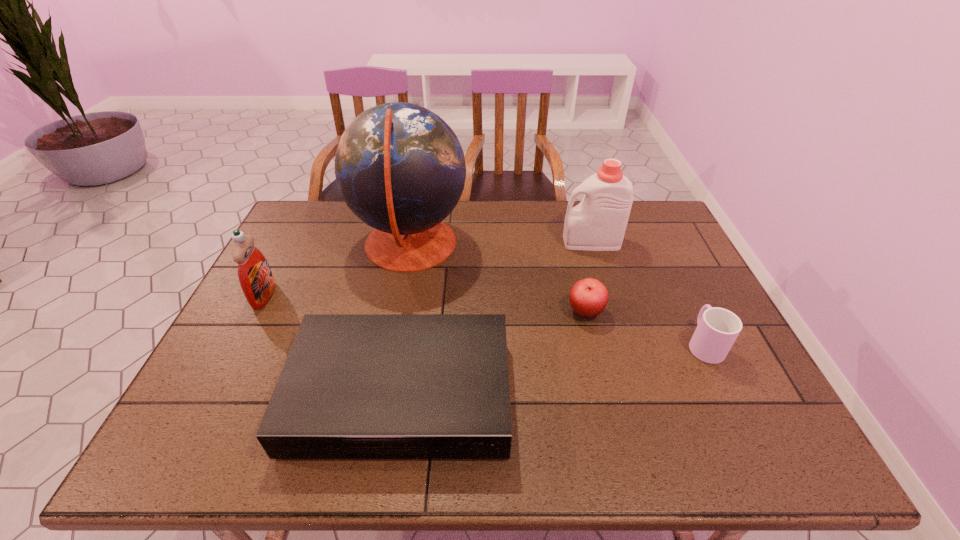
Locate an element on the screen. The width and height of the screenshot is (960, 540). vacant space situated 0.370m on the handle side of the fifth shortest object is located at coordinates (447, 242).

Identify the location of vacant space located 0.250m on the handle side of the fifth shortest object. The height and width of the screenshot is (540, 960). (485, 242).

This screenshot has height=540, width=960. What are the coordinates of `free spot located on the front surface of the left detergent` in the screenshot? It's located at click(306, 295).

Identify the location of blank area located 0.350m with the handle on the side of the cup. click(x=656, y=244).

At what (x,y) coordinates should I click in order to perform the action: click on vacant region located with the handle on the side of the cup. Please return your answer as a coordinate pair (x, y). The height and width of the screenshot is (540, 960). Looking at the image, I should click on (664, 261).

I want to click on vacant space positioned with the handle on the side of the cup, so click(652, 236).

Locate an element on the screen. This screenshot has width=960, height=540. vacant space located on the front of the apple is located at coordinates (604, 388).

You are a GUI agent. You are given a task and a screenshot of the screen. Output one action in this format:
    pyautogui.click(x=<x>, y=<y>)
    Task: Click on the globe at the far edge
    This screenshot has width=960, height=540.
    Given the screenshot: What is the action you would take?
    pyautogui.click(x=400, y=168)

This screenshot has width=960, height=540. I want to click on detergent positioned at the far edge, so click(598, 223).

The image size is (960, 540). What are the coordinates of `object situated at the near edge` in the screenshot? It's located at point(354,386).